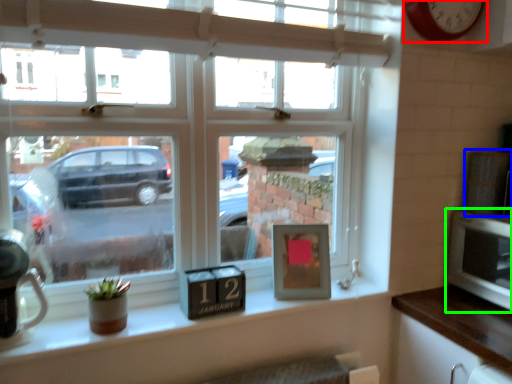
Question: Considering the real-world distances, which object is farthest from clock (highlighted by a red box)? appliance (highlighted by a blue box) or microwave (highlighted by a green box)?

Choices:
 (A) appliance
 (B) microwave

Answer: (B)